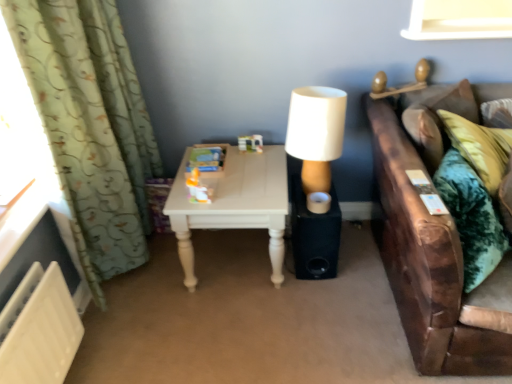
In order to click on free point in front of white painted wood table at center in this screenshot , I will do `click(225, 336)`.